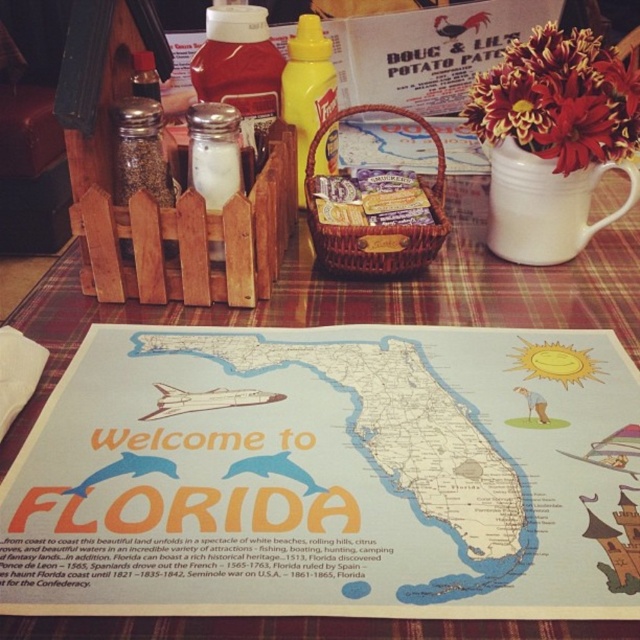
Question: Is the position of wooden placemat at center more distant than that of yellow matte mustard at center?

Choices:
 (A) yes
 (B) no

Answer: (B)

Question: Which point is farther to the camera?

Choices:
 (A) wooden placemat at center
 (B) yellow matte mustard at center

Answer: (B)

Question: Does wooden placemat at center appear under yellow matte mustard at center?

Choices:
 (A) no
 (B) yes

Answer: (B)

Question: Which object is closer to the camera taking this photo?

Choices:
 (A) wooden placemat at center
 (B) yellow matte mustard at center

Answer: (A)

Question: Where is wooden placemat at center located in relation to yellow matte mustard at center in the image?

Choices:
 (A) right
 (B) left

Answer: (A)